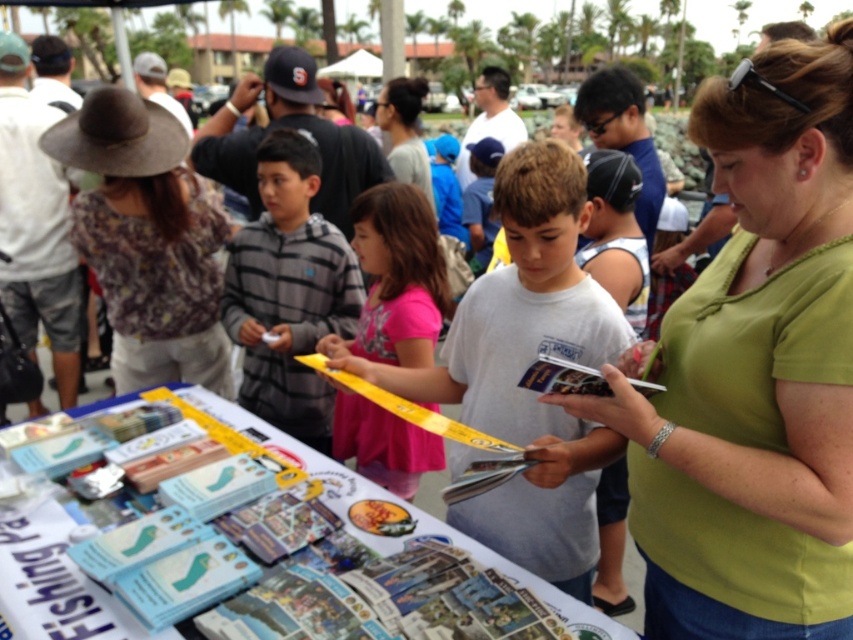
Looking at this image, you are organizing a safety briefing for attendees at this event. You need to ensure that everyone can hear you clearly. Given that the two people wearing the green matte shirt at center and the gray matte shirt at center are 10.91 feet apart, can you estimate whether they can hear you if you speak at a normal conversational volume?

The green matte shirt at center and gray matte shirt at center are 10.91 feet apart from each other. At a normal conversational volume, people can typically hear up to about 10 feet away. Since they are slightly farther apart than that, they may have difficulty hearing you clearly unless you raise your voice or use a microphone.

You are attending a community fair and see two items on the table. One is the green matte shirt at center and the other is the brown woven hat at upper left. Which item takes up less space on the table?

The green matte shirt at center takes up less space on the table because it has a smaller size compared to the brown woven hat at upper left.